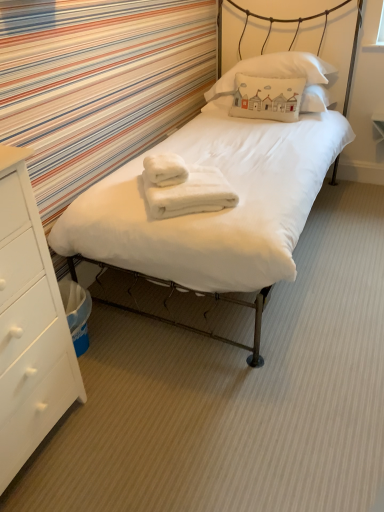
Question: Can you confirm if white soft towel at center, which ranks as the 1th bath towel in left-to-right order, is shorter than white cotton pillow at center, which is counted as the first pillow, starting from the bottom?

Choices:
 (A) yes
 (B) no

Answer: (A)

Question: Is white soft towel at center, which appears as the 2th bath towel when viewed from the right, in contact with white cotton pillow at center, which is counted as the first pillow, starting from the bottom?

Choices:
 (A) yes
 (B) no

Answer: (B)

Question: Does white soft towel at center, which appears as the 2th bath towel when viewed from the right, turn towards white cotton pillow at center, which is counted as the first pillow, starting from the bottom?

Choices:
 (A) no
 (B) yes

Answer: (A)

Question: From a real-world perspective, is white soft towel at center, which appears as the 2th bath towel when viewed from the right, located higher than white cotton pillow at center, which is counted as the first pillow, starting from the bottom?

Choices:
 (A) yes
 (B) no

Answer: (B)

Question: Considering the relative positions of white soft towel at center, which ranks as the 1th bath towel in left-to-right order, and white cotton pillow at center, which is counted as the first pillow, starting from the bottom, in the image provided, is white soft towel at center, which ranks as the 1th bath towel in left-to-right order, to the right of white cotton pillow at center, which is counted as the first pillow, starting from the bottom, from the viewer's perspective?

Choices:
 (A) no
 (B) yes

Answer: (A)

Question: Can you confirm if white soft towel at center, which ranks as the 1th bath towel in left-to-right order, is wider than white cotton pillow at center, arranged as the 2th pillow when viewed from the top?

Choices:
 (A) yes
 (B) no

Answer: (A)

Question: From the image's perspective, would you say white matte bed at center is positioned over white cotton pillow at center, which is counted as the first pillow, starting from the bottom?

Choices:
 (A) no
 (B) yes

Answer: (A)

Question: Can you confirm if white matte bed at center is taller than white cotton pillow at center, arranged as the 2th pillow when viewed from the top?

Choices:
 (A) no
 (B) yes

Answer: (B)

Question: Is white matte bed at center further to the viewer compared to white cotton pillow at center, which is counted as the first pillow, starting from the bottom?

Choices:
 (A) yes
 (B) no

Answer: (B)

Question: Is white matte bed at center smaller than white cotton pillow at center, which is counted as the first pillow, starting from the bottom?

Choices:
 (A) yes
 (B) no

Answer: (B)

Question: From a real-world perspective, is white matte bed at center under white cotton pillow at center, which is counted as the first pillow, starting from the bottom?

Choices:
 (A) yes
 (B) no

Answer: (A)

Question: Considering the relative sizes of white matte bed at center and white cotton pillow at center, which is counted as the first pillow, starting from the bottom, in the image provided, is white matte bed at center wider than white cotton pillow at center, which is counted as the first pillow, starting from the bottom,?

Choices:
 (A) no
 (B) yes

Answer: (B)

Question: Are white wood chest of drawers at lower left and white soft towel at center, the first bath towel in the right-to-left sequence, beside each other?

Choices:
 (A) no
 (B) yes

Answer: (A)